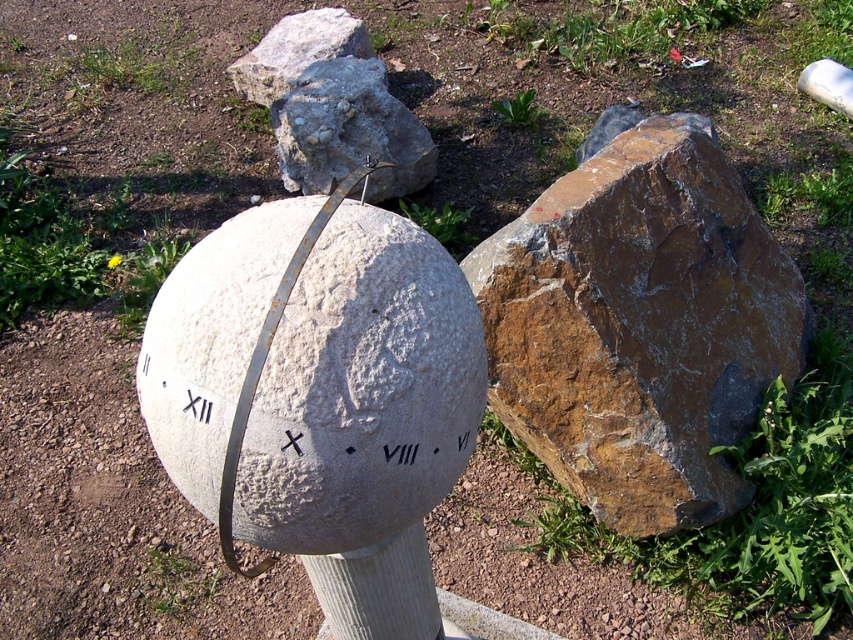
Who is more forward, (741, 368) or (456, 406)?

Point (456, 406)

Does rusty metallic boulder at right appear on the right side of white stone sphere at center?

Yes, rusty metallic boulder at right is to the right of white stone sphere at center.

Locate an element on the screen. rusty metallic boulder at right is located at coordinates (640, 324).

Describe the element at coordinates (640, 324) in the screenshot. This screenshot has height=640, width=853. I see `rusty metallic boulder at right` at that location.

Which is in front, point (491, 372) or point (381, 116)?

Point (491, 372) is more forward.

You are a GUI agent. You are given a task and a screenshot of the screen. Output one action in this format:
    pyautogui.click(x=<x>, y=<y>)
    Task: Click on the rusty metallic boulder at right
    
    Given the screenshot: What is the action you would take?
    pyautogui.click(x=640, y=324)

The image size is (853, 640). Identify the location of white stone sphere at center. (363, 392).

Can you confirm if white stone sphere at center is shorter than gray rough stone boulder at center?

Yes.

Is point (206, 314) less distant than point (386, 81)?

Yes.

Find the location of a particular element. white stone sphere at center is located at coordinates (363, 392).